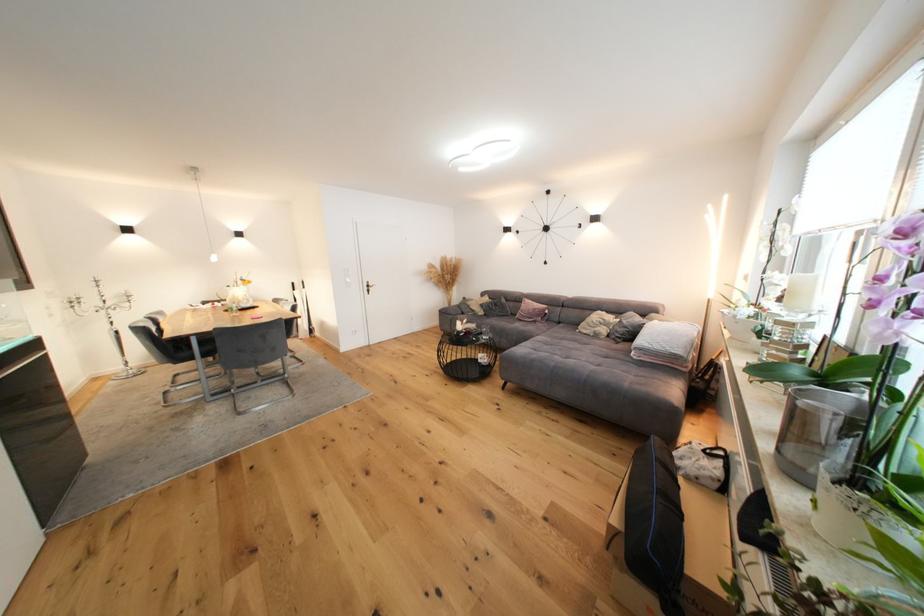
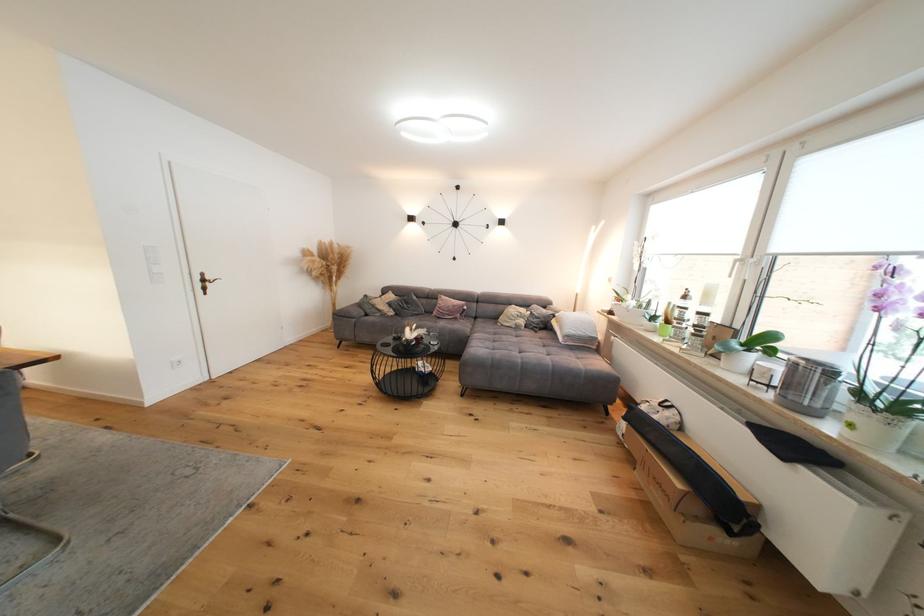
Locate, in the second image, the point that corresponds to (x=602, y=338) in the first image.

(524, 330)